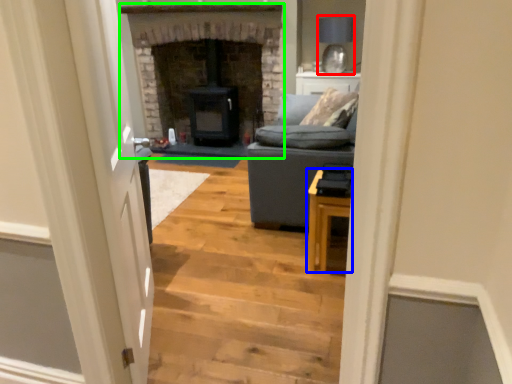
Question: Which object is the farthest from lamp (highlighted by a red box)? Choose among these: table (highlighted by a blue box) or fireplace (highlighted by a green box).

Choices:
 (A) table
 (B) fireplace

Answer: (A)